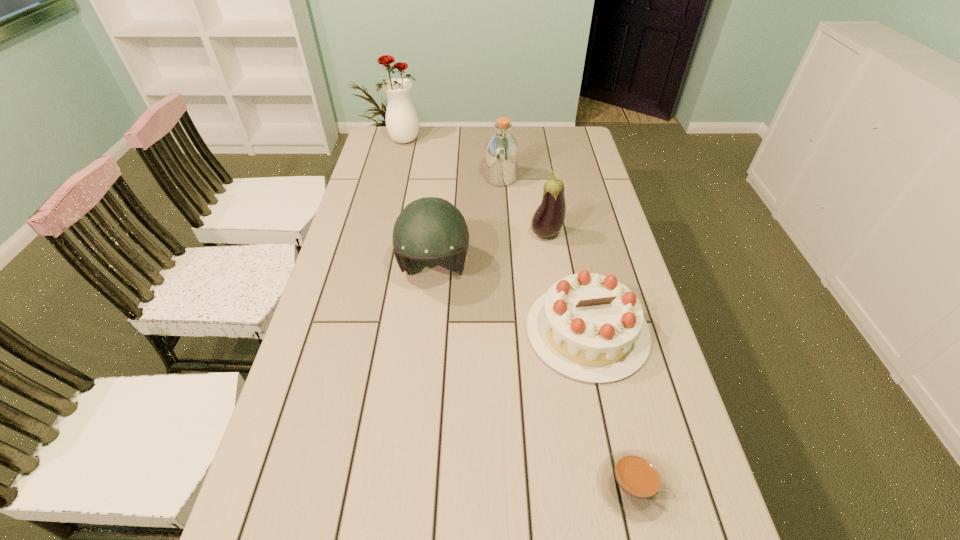
You are a GUI agent. You are given a task and a screenshot of the screen. Output one action in this format:
    pyautogui.click(x=<x>, y=<y>)
    Task: Click on the vacant area situated 0.370m on the front of the fifth nearest object
    The width and height of the screenshot is (960, 540).
    Given the screenshot: What is the action you would take?
    pyautogui.click(x=506, y=258)

You are a GUI agent. You are given a task and a screenshot of the screen. Output one action in this format:
    pyautogui.click(x=<x>, y=<y>)
    Task: Click on the free region located at the face opening of the football helmet
    
    Given the screenshot: What is the action you would take?
    pyautogui.click(x=419, y=417)

Where is `free region located 0.310m on the front of the birthday cake`? The image size is (960, 540). free region located 0.310m on the front of the birthday cake is located at coordinates (629, 531).

In order to click on vacant area situated 0.290m on the back of the nearest object in this screenshot , I will do `click(598, 340)`.

Where is `object present at the far edge`? The width and height of the screenshot is (960, 540). object present at the far edge is located at coordinates (402, 122).

The image size is (960, 540). What are the coordinates of `object located in the left edge section of the desktop` in the screenshot? It's located at (402, 122).

This screenshot has height=540, width=960. I want to click on birthday cake that is at the right edge, so click(589, 327).

The height and width of the screenshot is (540, 960). Find the location of `cappuccino located in the right edge section of the desktop`. cappuccino located in the right edge section of the desktop is located at coordinates (632, 482).

Image resolution: width=960 pixels, height=540 pixels. I want to click on object that is at the far left corner, so click(x=402, y=122).

You are a GUI agent. You are given a task and a screenshot of the screen. Output one action in this format:
    pyautogui.click(x=<x>, y=<y>)
    Task: Click on the vacant space at the far edge of the desktop
    The width and height of the screenshot is (960, 540).
    Given the screenshot: What is the action you would take?
    pyautogui.click(x=434, y=126)